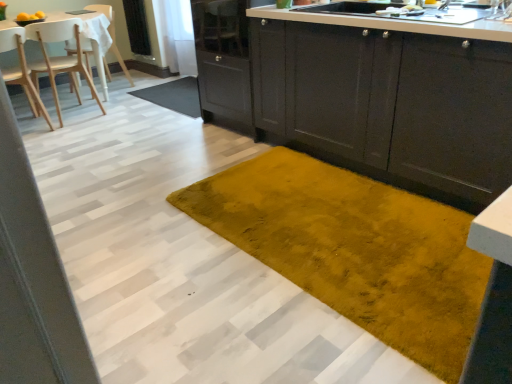
Question: In which direction should I rotate to look at velvet yellow rug at center, marked as the second doormat in a back-to-front arrangement?

Choices:
 (A) left
 (B) right

Answer: (B)

Question: Is metallic silver faucet at upper right thinner than transparent glass screen door at upper center?

Choices:
 (A) no
 (B) yes

Answer: (A)

Question: Is metallic silver faucet at upper right with transparent glass screen door at upper center?

Choices:
 (A) yes
 (B) no

Answer: (B)

Question: Is metallic silver faucet at upper right surrounding transparent glass screen door at upper center?

Choices:
 (A) yes
 (B) no

Answer: (B)

Question: Can you confirm if metallic silver faucet at upper right is shorter than transparent glass screen door at upper center?

Choices:
 (A) yes
 (B) no

Answer: (A)

Question: From a real-world perspective, is metallic silver faucet at upper right physically below transparent glass screen door at upper center?

Choices:
 (A) yes
 (B) no

Answer: (B)

Question: Is metallic silver faucet at upper right smaller than transparent glass screen door at upper center?

Choices:
 (A) yes
 (B) no

Answer: (A)

Question: From a real-world perspective, is transparent glass screen door at upper center physically above white glossy countertop at upper center?

Choices:
 (A) no
 (B) yes

Answer: (A)

Question: From the image's perspective, does transparent glass screen door at upper center appear lower than white glossy countertop at upper center?

Choices:
 (A) yes
 (B) no

Answer: (B)

Question: Considering the relative sizes of transparent glass screen door at upper center and white glossy countertop at upper center in the image provided, is transparent glass screen door at upper center wider than white glossy countertop at upper center?

Choices:
 (A) no
 (B) yes

Answer: (A)

Question: Would you say transparent glass screen door at upper center is a long distance from white glossy countertop at upper center?

Choices:
 (A) yes
 (B) no

Answer: (A)

Question: From a real-world perspective, is transparent glass screen door at upper center under white glossy countertop at upper center?

Choices:
 (A) yes
 (B) no

Answer: (A)

Question: Is white glossy countertop at upper center located within transparent glass screen door at upper center?

Choices:
 (A) yes
 (B) no

Answer: (B)

Question: From a real-world perspective, is mustard yellow plush rug at center, which is the second doormat from front to back, on top of wooden chair at left, the 2th chair from the front?

Choices:
 (A) no
 (B) yes

Answer: (A)